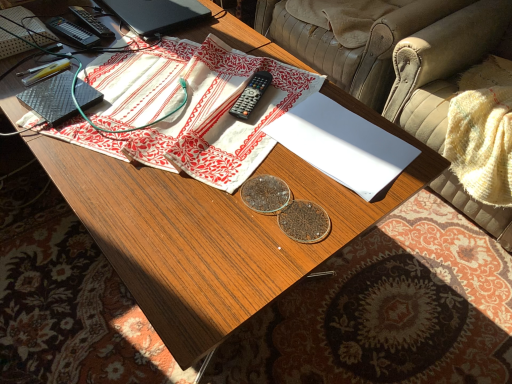
The height and width of the screenshot is (384, 512). I want to click on vacant area on top of white paper at center (from a real-world perspective), so click(340, 136).